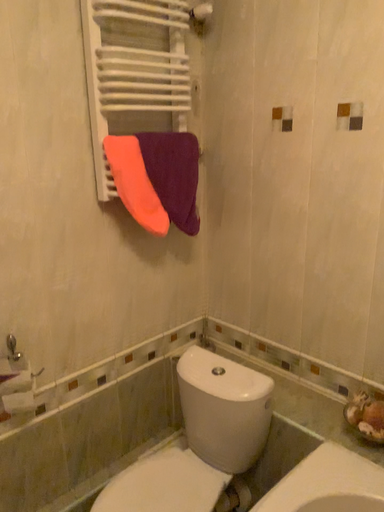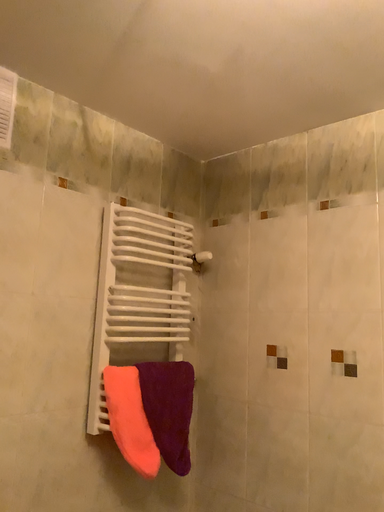
Question: Which way did the camera rotate in the video?

Choices:
 (A) rotated downward
 (B) rotated upward

Answer: (B)